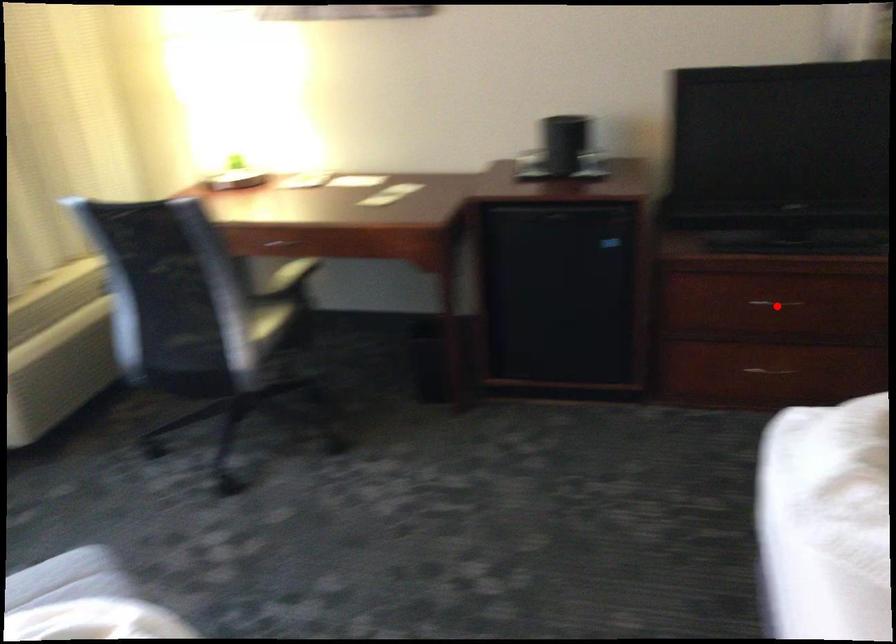
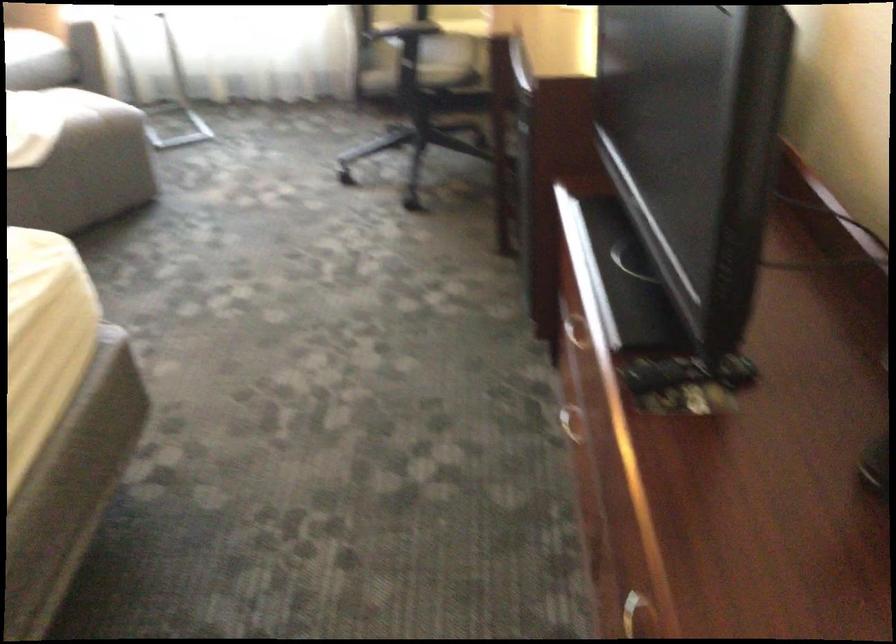
Question: I am providing you with two images of the same scene from different viewpoints. A red point is marked on the first image. Can you still see the location of the red point in image 2?

Choices:
 (A) Yes
 (B) No

Answer: (B)